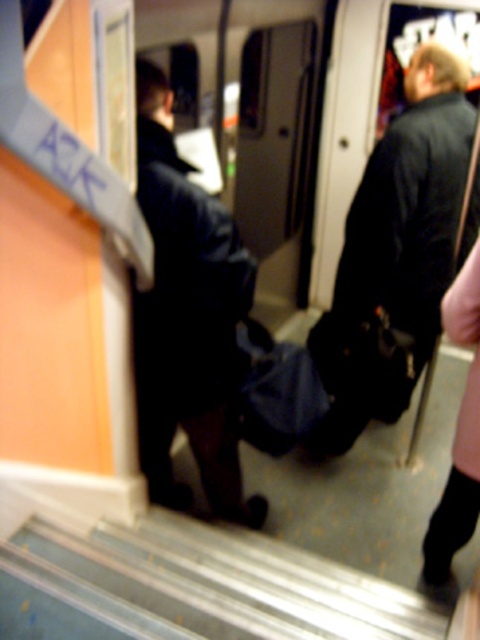
Can you confirm if metallic gray stairs at lower center is positioned below black leather jacket at right?

Yes, metallic gray stairs at lower center is below black leather jacket at right.

Is metallic gray stairs at lower center further to camera compared to black leather jacket at right?

No, metallic gray stairs at lower center is closer to the viewer.

Which is in front, point (101, 525) or point (463, 182)?

Positioned in front is point (101, 525).

Where is `metallic gray stairs at lower center`? The width and height of the screenshot is (480, 640). metallic gray stairs at lower center is located at coordinates (211, 582).

Who is more distant from viewer, (x=131, y=538) or (x=168, y=497)?

Point (x=168, y=497)

Does metallic gray stairs at lower center appear on the right side of black leather jacket at center?

Correct, you'll find metallic gray stairs at lower center to the right of black leather jacket at center.

Who is more forward, (x=253, y=588) or (x=204, y=246)?

Point (x=204, y=246)

Identify the location of metallic gray stairs at lower center. Image resolution: width=480 pixels, height=640 pixels. (211, 582).

From the picture: Who is positioned more to the left, black leather jacket at center or black leather jacket at right?

black leather jacket at center is more to the left.

Does black leather jacket at center appear under black leather jacket at right?

Yes.

Who is more forward, [175,348] or [342,388]?

Positioned in front is point [175,348].

You are a GUI agent. You are given a task and a screenshot of the screen. Output one action in this format:
    pyautogui.click(x=<x>, y=<y>)
    Task: Click on the black leather jacket at center
    Image resolution: width=480 pixels, height=640 pixels.
    Given the screenshot: What is the action you would take?
    pyautogui.click(x=188, y=317)